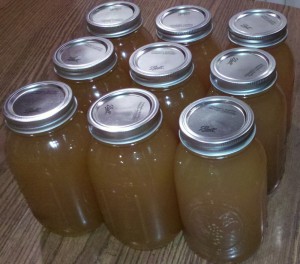
What are the coordinates of `center jar` in the screenshot? It's located at (172, 106).